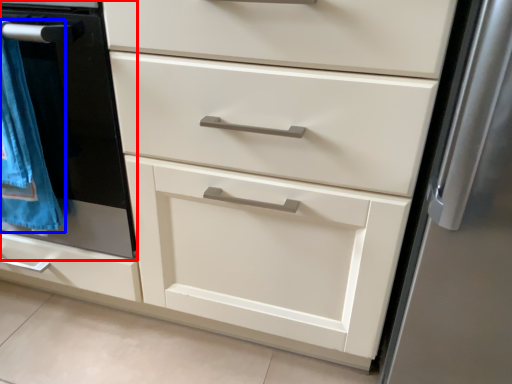
Question: Which point is further to the camera, oven (highlighted by a red box) or blanket (highlighted by a blue box)?

Choices:
 (A) oven
 (B) blanket

Answer: (B)